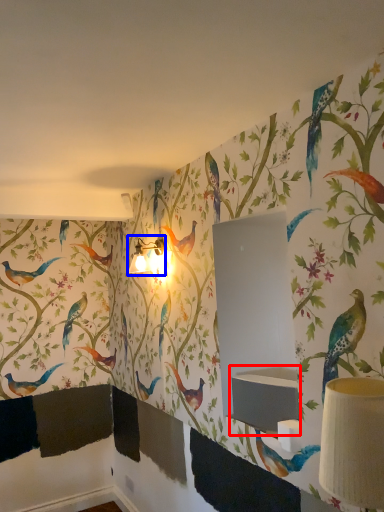
Question: Among these objects, which one is nearest to the camera, sink (highlighted by a red box) or table lamp (highlighted by a blue box)?

Choices:
 (A) sink
 (B) table lamp

Answer: (A)